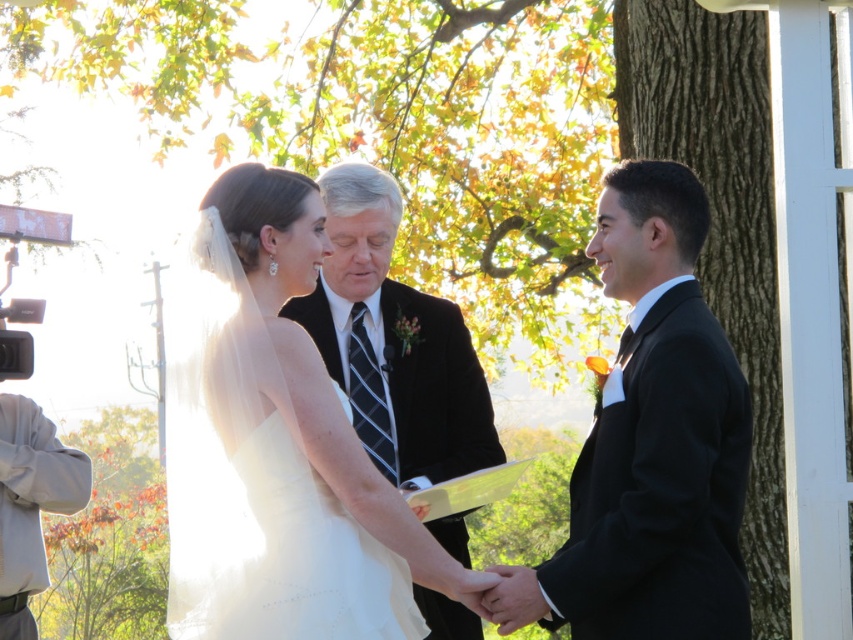
Question: Is white satin dress at center above black satin suit at right?

Choices:
 (A) yes
 (B) no

Answer: (B)

Question: Does white satin dress at center have a lesser width compared to black satin suit at right?

Choices:
 (A) yes
 (B) no

Answer: (B)

Question: Which point is farther from the camera taking this photo?

Choices:
 (A) (355, 497)
 (B) (729, 496)

Answer: (B)

Question: Which object appears closest to the camera in this image?

Choices:
 (A) black satin suit at right
 (B) white satin dress at center

Answer: (B)

Question: Can you confirm if white satin dress at center is wider than black satin suit at right?

Choices:
 (A) yes
 (B) no

Answer: (A)